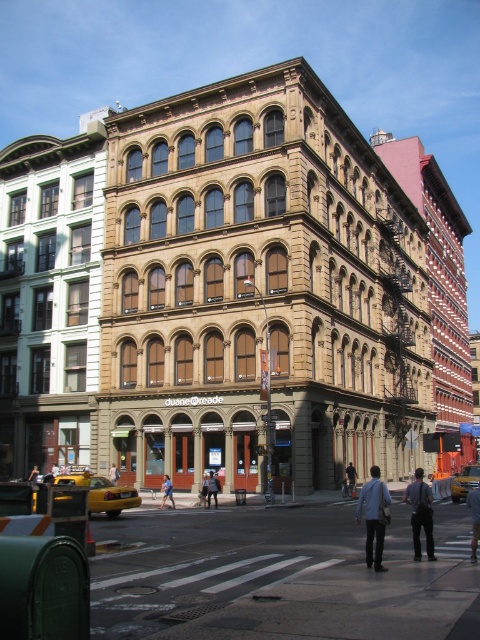
Is point (112, 483) positioned behind point (35, 470)?

No, it is in front of (35, 470).

Which of these two, denim jacket at lower right or blue jeans at lower center, stands taller?

blue jeans at lower center

Is point (116, 476) in front of point (36, 474)?

Yes.

Find the location of `denim jacket at lower right`. denim jacket at lower right is located at coordinates (113, 474).

Is denim jacket at lower center below denim jacket at lower right?

No.

The height and width of the screenshot is (640, 480). Identify the location of denim jacket at lower center. (213, 488).

Between dark gray suit at center and blue fabric shirt at center, which one has more height?

dark gray suit at center is taller.

Who is more forward, (410, 518) or (167, 476)?

Point (410, 518)

Who is more forward, (415, 552) or (166, 483)?

Point (415, 552) is in front.

Find the location of `dark gray suit at center`. dark gray suit at center is located at coordinates (420, 513).